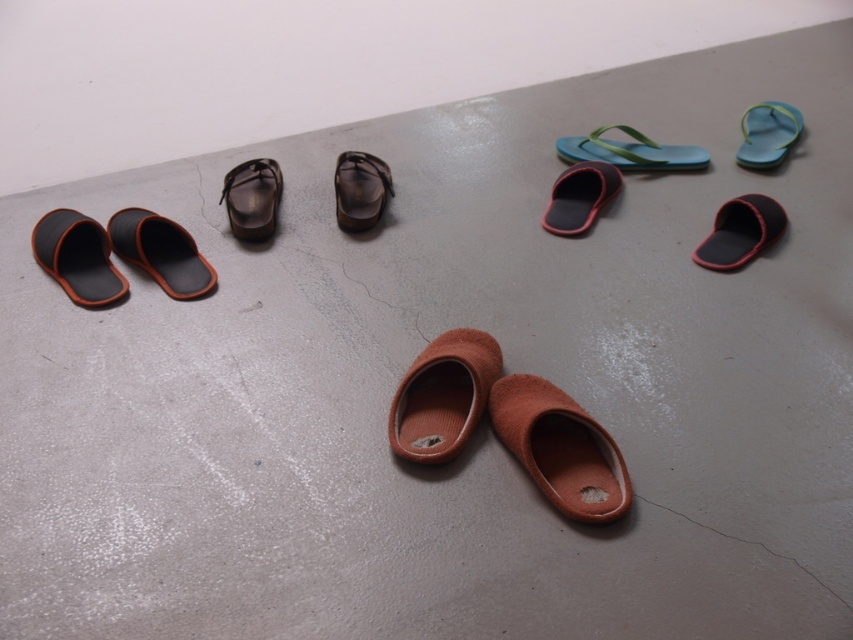
Question: Does brown suede slipper at center lie in front of matte black slipper at lower left?

Choices:
 (A) yes
 (B) no

Answer: (A)

Question: Can you confirm if brown suede slipper at lower center is positioned to the right of leather-like brown slipper at center?

Choices:
 (A) yes
 (B) no

Answer: (A)

Question: Among these objects, which one is farthest from the camera?

Choices:
 (A) matte black slipper at lower left
 (B) matte black slipper at left
 (C) black suede slipper at right

Answer: (C)

Question: Is brown suede slipper at center wider than matte black slipper at left?

Choices:
 (A) no
 (B) yes

Answer: (A)

Question: Among these objects, which one is nearest to the camera?

Choices:
 (A) black suede slipper at right
 (B) matte green flip-flop at upper right

Answer: (A)

Question: Estimate the real-world distances between objects in this image. Which object is closer to the brown suede slipper at lower center?

Choices:
 (A) matte green flip-flop at upper right
 (B) matte black slipper at left

Answer: (B)